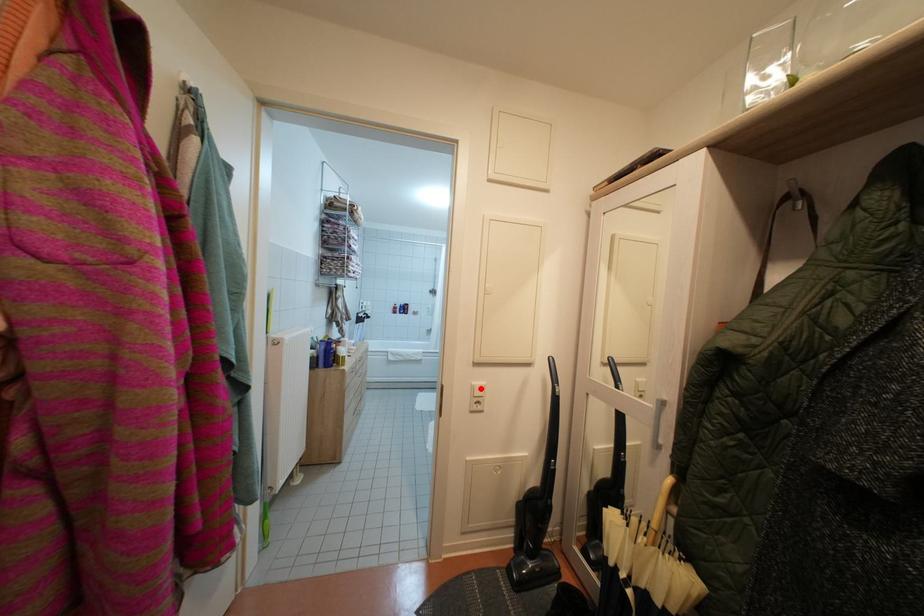
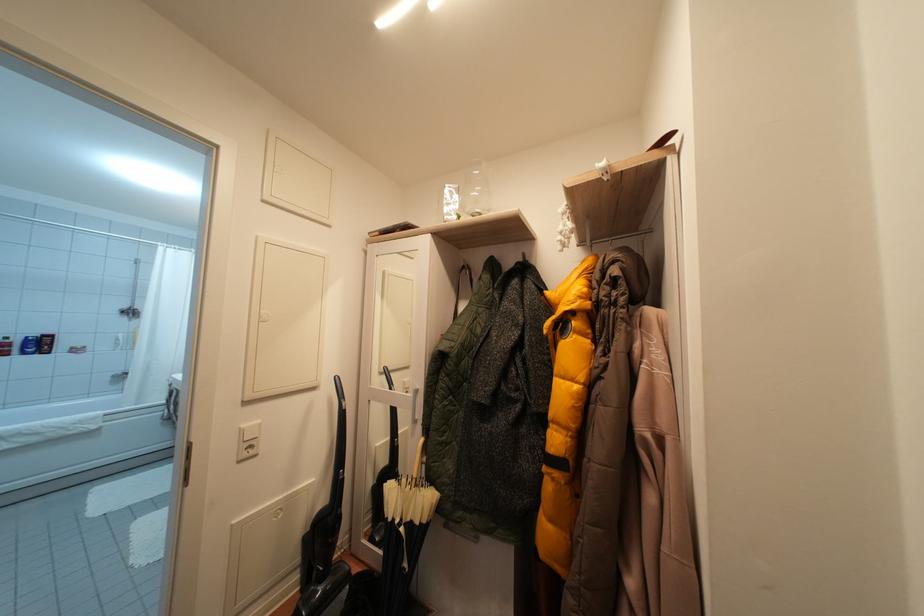
Question: I am providing you with two images of the same scene from different viewpoints. Image1 has a red point marked. In image2, the corresponding 3D location appears at what relative position? Reply with the corresponding letter.

Choices:
 (A) Closer
 (B) Farther

Answer: (A)